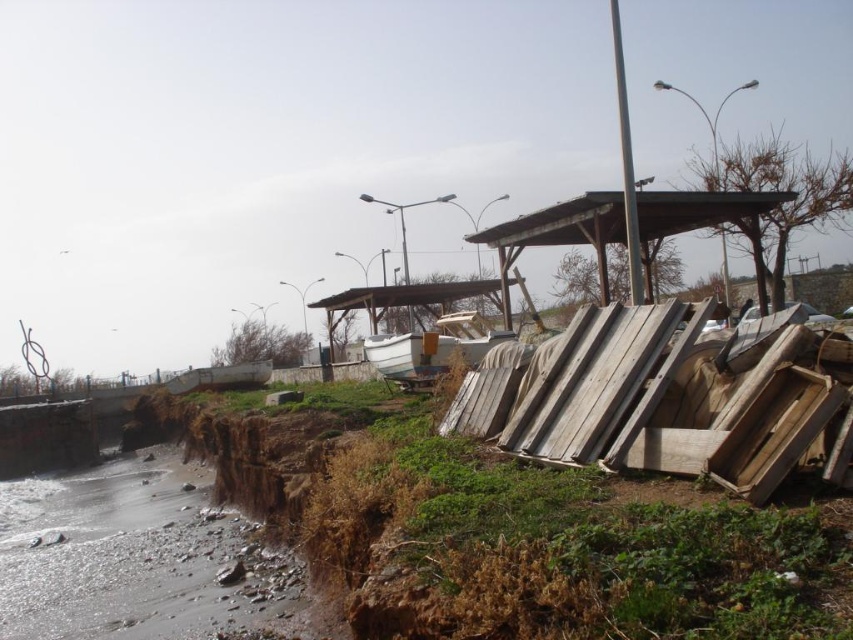
You are a marine biologist studying coastal erosion. You observe the wooden shelter at center and the white matte boat at center in the image. Which object is located above the other?

The wooden shelter at center is positioned over the white matte boat at center, so the wooden shelter is above the boat.

You are a coastal inspector assessing damage after a storm. You see a wooden shelter at center and a white matte boat at center. Which object is smaller in size?

The wooden shelter at center is smaller in size compared to the white matte boat at center.